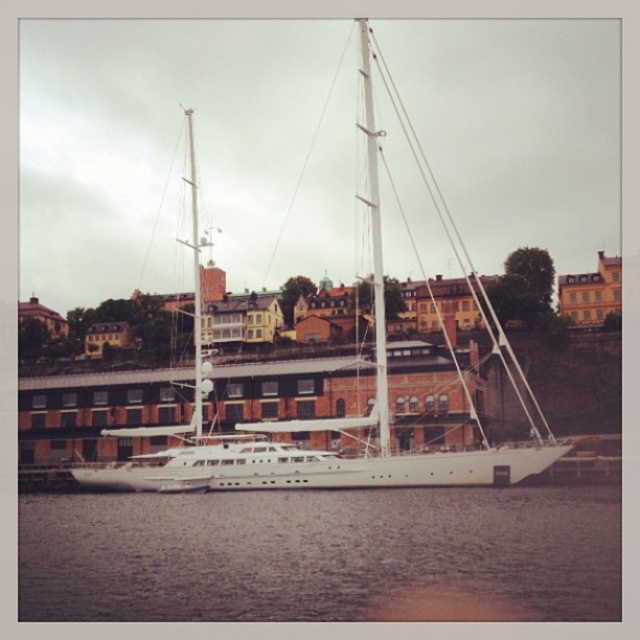
You are a photographer planning to take a photo of the waterfront scene. You want to ensure that both the clear water at lower center and the white glossy sailboat at center are visible in the frame. Based on their positions, which object should you focus on first to capture both in the shot?

The clear water at lower center is below the white glossy sailboat at center, so focusing on the sailboat first will naturally include the water in the lower part of the frame.